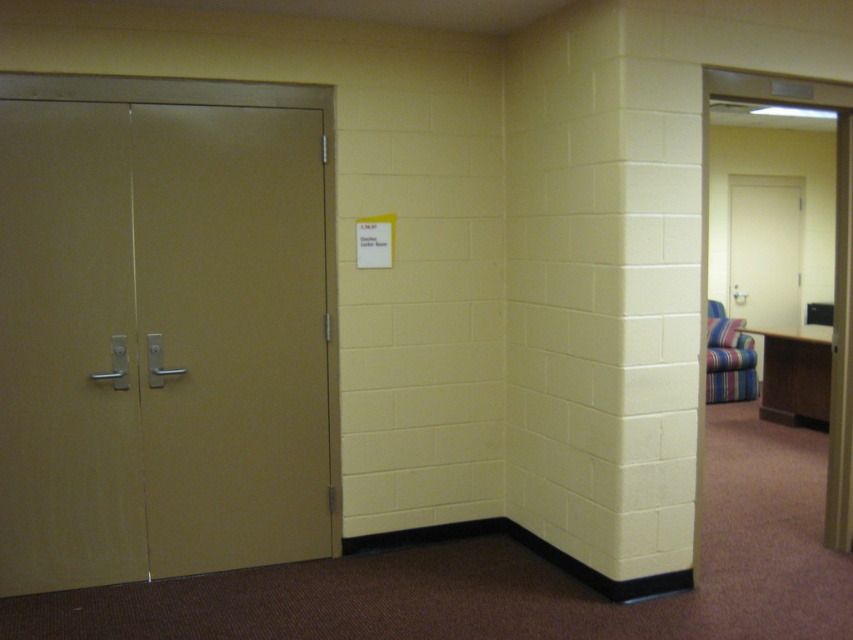
Question: Does metallic gold elevator at left appear on the left side of striped fabric armchair at right?

Choices:
 (A) no
 (B) yes

Answer: (B)

Question: Can you confirm if metallic gold elevator at left is thinner than striped fabric armchair at right?

Choices:
 (A) no
 (B) yes

Answer: (A)

Question: Among these points, which one is farthest from the camera?

Choices:
 (A) (144, 449)
 (B) (738, 372)

Answer: (B)

Question: Can you confirm if metallic gold elevator at left is positioned to the right of striped fabric armchair at right?

Choices:
 (A) yes
 (B) no

Answer: (B)

Question: Among these objects, which one is nearest to the camera?

Choices:
 (A) striped fabric armchair at right
 (B) metallic gold elevator at left

Answer: (B)